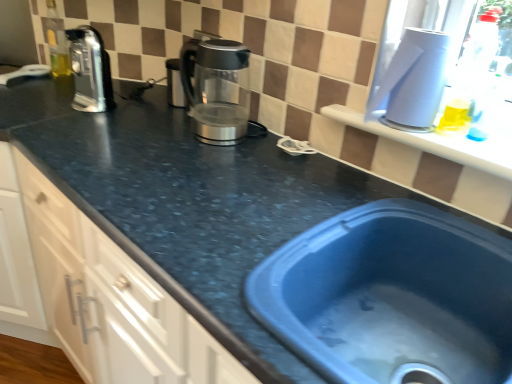
What is the approximate width of blue plastic sink at lower right?

blue plastic sink at lower right is 19.86 inches in width.

Locate an element on the screen. Image resolution: width=512 pixels, height=384 pixels. satin silver kettle at center, the 2th appliance viewed from the right is located at coordinates (175, 85).

Which is closer to the camera, (350, 272) or (412, 82)?

Positioned in front is point (412, 82).

Which of these two, blue plastic sink at lower right or white plastic container at upper right, marked as the second appliance in a back-to-front arrangement, stands shorter?

Standing shorter between the two is blue plastic sink at lower right.

Measure the distance from blue plastic sink at lower right to white plastic container at upper right, which ranks as the first appliance in front-to-back order.

blue plastic sink at lower right and white plastic container at upper right, which ranks as the first appliance in front-to-back order, are 13.84 inches apart.

Are blue plastic sink at lower right and white plastic container at upper right, placed as the 1th appliance when sorted from right to left, making contact?

There is a gap between blue plastic sink at lower right and white plastic container at upper right, placed as the 1th appliance when sorted from right to left.

Could you tell me if sleek metallic kettle at center is facing satin silver coffee pot at upper left?

No, sleek metallic kettle at center is not oriented towards satin silver coffee pot at upper left.

How distant is sleek metallic kettle at center from satin silver coffee pot at upper left?

The distance of sleek metallic kettle at center from satin silver coffee pot at upper left is 34.75 centimeters.

I want to click on coffeepot below the sleek metallic kettle at center (from a real-world perspective), so click(x=90, y=70).

From a real-world perspective, is sleek metallic kettle at center positioned over satin silver coffee pot at upper left based on gravity?

Yes.

Is white plastic container at upper right, acting as the second appliance starting from the left, taller or shorter than blue plastic sink at lower right?

Considering their sizes, white plastic container at upper right, acting as the second appliance starting from the left, has more height than blue plastic sink at lower right.

Is white plastic container at upper right, which ranks as the first appliance in front-to-back order, facing towards blue plastic sink at lower right?

No, white plastic container at upper right, which ranks as the first appliance in front-to-back order, is not turned towards blue plastic sink at lower right.

From the image's perspective, who appears lower, white plastic container at upper right, placed as the 1th appliance when sorted from right to left, or blue plastic sink at lower right?

From the image's view, blue plastic sink at lower right is below.

Where is `appliance that is the 1st object located behind the blue plastic sink at lower right`? appliance that is the 1st object located behind the blue plastic sink at lower right is located at coordinates (412, 82).

Consider the image. Considering the sizes of objects matte black countertop at left and white plastic container at upper right, marked as the second appliance in a back-to-front arrangement, in the image provided, who is wider, matte black countertop at left or white plastic container at upper right, marked as the second appliance in a back-to-front arrangement,?

matte black countertop at left is wider.

Where is `cabinetry lying behind the white plastic container at upper right, acting as the second appliance starting from the left`? The image size is (512, 384). cabinetry lying behind the white plastic container at upper right, acting as the second appliance starting from the left is located at coordinates (113, 301).

Is matte black countertop at left with white plastic container at upper right, placed as the 1th appliance when sorted from right to left?

No, matte black countertop at left is not next to white plastic container at upper right, placed as the 1th appliance when sorted from right to left.

From the image's perspective, is matte black countertop at left located beneath white plastic container at upper right, placed as the 1th appliance when sorted from right to left?

Indeed, from the image's perspective, matte black countertop at left is shown beneath white plastic container at upper right, placed as the 1th appliance when sorted from right to left.

Which is closer, (71, 48) or (55, 318)?

Point (71, 48) is farther from the camera than point (55, 318).

Is matte black countertop at left located within satin silver coffee pot at upper left?

Definitely not — matte black countertop at left is not inside satin silver coffee pot at upper left.

Which object is positioned more to the right, satin silver coffee pot at upper left or matte black countertop at left?

Positioned to the right is satin silver coffee pot at upper left.

From the image's perspective, between white plastic container at upper right, placed as the 1th appliance when sorted from right to left, and matte black countertop at left, which one is located above?

From the image's view, white plastic container at upper right, placed as the 1th appliance when sorted from right to left, is above.

Between white plastic container at upper right, marked as the second appliance in a back-to-front arrangement, and matte black countertop at left, which one has larger size?

matte black countertop at left is bigger.

Are white plastic container at upper right, marked as the second appliance in a back-to-front arrangement, and matte black countertop at left making contact?

No.

From a real-world perspective, is white plastic container at upper right, marked as the second appliance in a back-to-front arrangement, positioned over matte black countertop at left based on gravity?

Indeed, from a real-world perspective, white plastic container at upper right, marked as the second appliance in a back-to-front arrangement, stands above matte black countertop at left.

Is satin silver kettle at center, which appears as the second appliance when viewed from the front, in front of satin silver coffee pot at upper left?

No, satin silver kettle at center, which appears as the second appliance when viewed from the front, is further to the viewer.

Between point (170, 60) and point (93, 110), which one is positioned behind?

Point (170, 60)

Identify the location of coffeepot above the satin silver kettle at center, the 2th appliance viewed from the right (from the image's perspective). This screenshot has width=512, height=384. (90, 70).

Between satin silver kettle at center, placed as the 1th appliance when sorted from back to front, and satin silver coffee pot at upper left, which one has less height?

satin silver kettle at center, placed as the 1th appliance when sorted from back to front.

You are a GUI agent. You are given a task and a screenshot of the screen. Output one action in this format:
    pyautogui.click(x=<x>, y=<y>)
    Task: Click on the sink on the left side of white plastic container at upper right, marked as the second appliance in a back-to-front arrangement
    
    Given the screenshot: What is the action you would take?
    pyautogui.click(x=392, y=297)

The width and height of the screenshot is (512, 384). Find the location of `coffeepot beneath the sleek metallic kettle at center (from a real-world perspective)`. coffeepot beneath the sleek metallic kettle at center (from a real-world perspective) is located at coordinates point(90,70).

When comparing their distances from satin silver coffee pot at upper left, does blue plastic sink at lower right or matte black countertop at left seem further?

blue plastic sink at lower right is further to satin silver coffee pot at upper left.

When comparing their distances from satin silver coffee pot at upper left, does white plastic container at upper right, placed as the 1th appliance when sorted from right to left, or sleek metallic kettle at center seem further?

Based on the image, white plastic container at upper right, placed as the 1th appliance when sorted from right to left, appears to be further to satin silver coffee pot at upper left.

Considering their positions, is satin silver coffee pot at upper left positioned further to matte black countertop at left than satin silver kettle at center, placed as the 1th appliance when sorted from back to front?

Among the two, satin silver kettle at center, placed as the 1th appliance when sorted from back to front, is located further to matte black countertop at left.

When comparing their distances from satin silver kettle at center, placed as the 1th appliance when sorted from back to front, does blue plastic sink at lower right or satin silver coffee pot at upper left seem further?

blue plastic sink at lower right lies further to satin silver kettle at center, placed as the 1th appliance when sorted from back to front, than the other object.

When comparing their distances from matte black countertop at left, does blue plastic sink at lower right or satin silver coffee pot at upper left seem further?

satin silver coffee pot at upper left.

From the image, which object appears to be farther from blue plastic sink at lower right, white plastic container at upper right, which ranks as the first appliance in front-to-back order, or satin silver kettle at center, which appears as the second appliance when viewed from the front?

The object further to blue plastic sink at lower right is satin silver kettle at center, which appears as the second appliance when viewed from the front.

Looking at the image, which one is located closer to sleek metallic kettle at center, satin silver kettle at center, which appears as the second appliance when viewed from the front, or blue plastic sink at lower right?

satin silver kettle at center, which appears as the second appliance when viewed from the front, lies closer to sleek metallic kettle at center than the other object.

Based on their spatial positions, is white plastic container at upper right, marked as the second appliance in a back-to-front arrangement, or sleek metallic kettle at center closer to satin silver kettle at center, the 2th appliance viewed from the right?

sleek metallic kettle at center lies closer to satin silver kettle at center, the 2th appliance viewed from the right, than the other object.

Where is `appliance between satin silver coffee pot at upper left and sleek metallic kettle at center`? This screenshot has height=384, width=512. appliance between satin silver coffee pot at upper left and sleek metallic kettle at center is located at coordinates (175, 85).

The height and width of the screenshot is (384, 512). In order to click on kitchen appliance between satin silver coffee pot at upper left and white plastic container at upper right, acting as the second appliance starting from the left, in the horizontal direction in this screenshot , I will do `click(217, 89)`.

Locate an element on the screen. sink situated between satin silver coffee pot at upper left and white plastic container at upper right, which ranks as the first appliance in front-to-back order, from left to right is located at coordinates (392, 297).

Identify the location of coffeepot situated between matte black countertop at left and satin silver kettle at center, placed as the 1th appliance when sorted from back to front, from left to right. (90, 70).